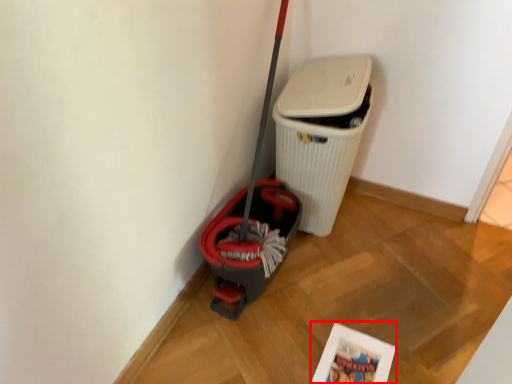
Question: Where is comic book (annotated by the red box) located in relation to waste container in the image?

Choices:
 (A) right
 (B) left

Answer: (A)